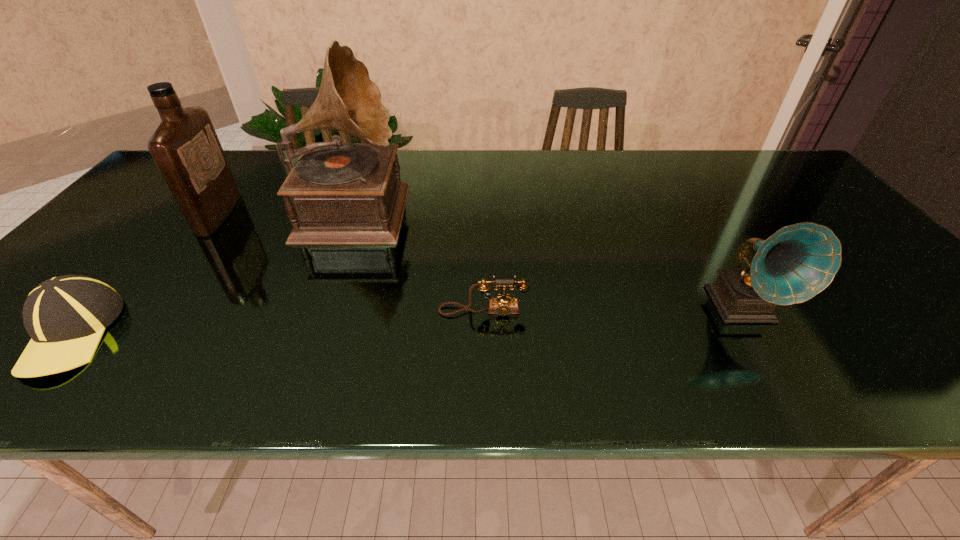
In order to click on the tallest object in this screenshot , I will do `click(337, 193)`.

Locate an element on the screen. This screenshot has width=960, height=540. the third object from left to right is located at coordinates (337, 193).

Image resolution: width=960 pixels, height=540 pixels. What are the coordinates of `liquor` in the screenshot? It's located at (185, 147).

Where is `the fourth shortest object`? the fourth shortest object is located at coordinates (185, 147).

The height and width of the screenshot is (540, 960). I want to click on the third shortest object, so click(x=797, y=262).

Where is `phonograph_record`? Image resolution: width=960 pixels, height=540 pixels. phonograph_record is located at coordinates click(x=797, y=262).

Where is `the second object from right to left`? the second object from right to left is located at coordinates (503, 305).

Where is `vacant space located from the horn of the record player`? The height and width of the screenshot is (540, 960). vacant space located from the horn of the record player is located at coordinates (469, 206).

Find the location of a particular element. vacant point located on the label side of the second tallest object is located at coordinates (372, 214).

Find the location of a particular element. The height and width of the screenshot is (540, 960). vacant area situated 0.090m on the front-facing side of the telephone is located at coordinates (483, 352).